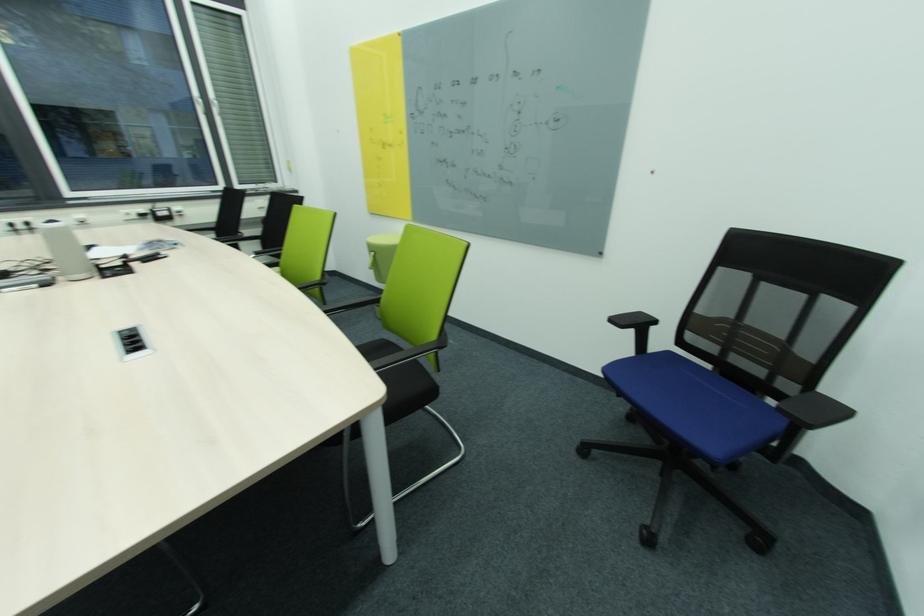
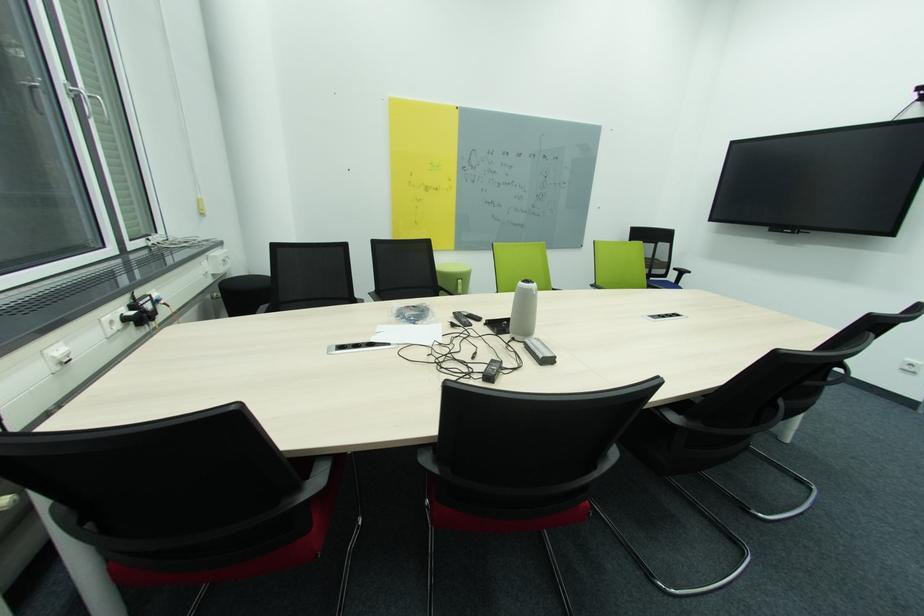
Question: I am providing you with two images of the same scene from different viewpoints. Which of the following objects are not visible in image2?

Choices:
 (A) grey water bottle
 (B) white plastic hanger
 (C) black chair armrest
 (D) black remote control

Answer: (C)